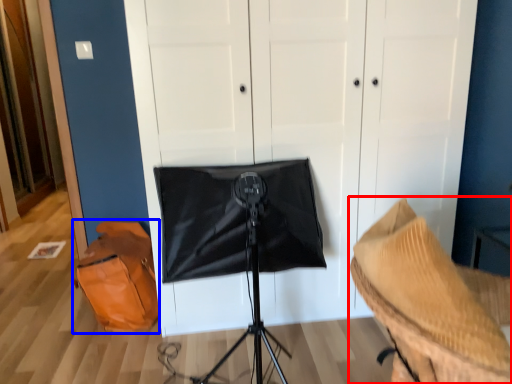
Question: Which object appears closest to the camera in this image, furniture (highlighted by a red box) or messenger bag (highlighted by a blue box)?

Choices:
 (A) furniture
 (B) messenger bag

Answer: (A)